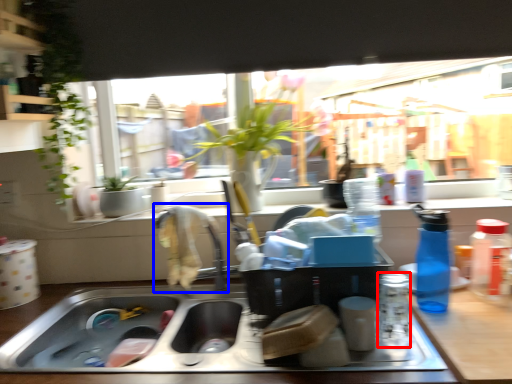
Question: Among these objects, which one is nearest to the camera, bottle (highlighted by a red box) or faucet (highlighted by a blue box)?

Choices:
 (A) bottle
 (B) faucet

Answer: (A)